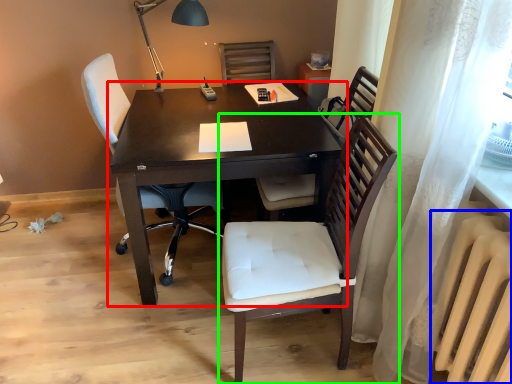
Question: Which is nearer to the desk (highlighted by a red box)? radiator (highlighted by a blue box) or chair (highlighted by a green box).

Choices:
 (A) radiator
 (B) chair

Answer: (B)